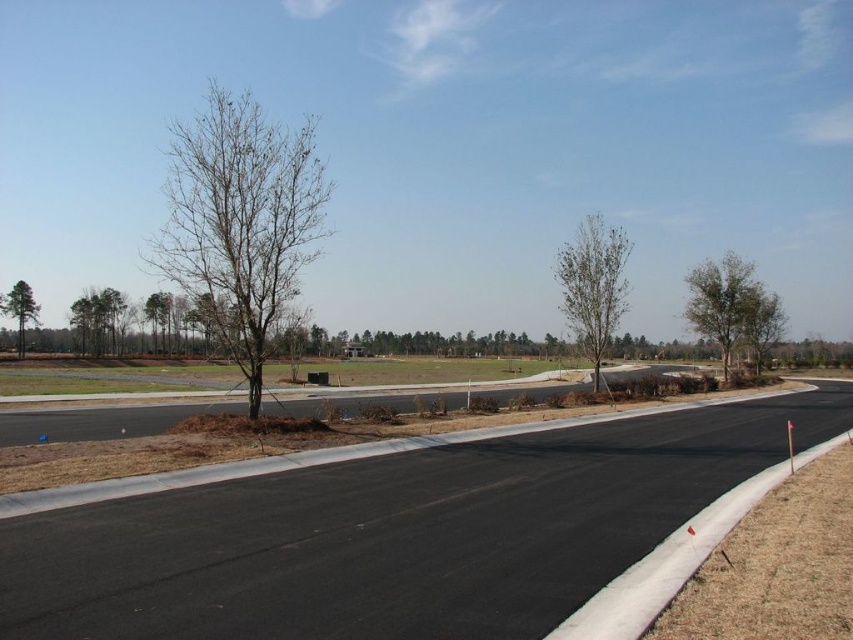
You are standing at the center of the newly paved road. Looking towards the direction of the road, where is the bare wood tree at left located relative to your position?

The bare wood tree at left is located at the left side of the road, positioned at coordinates approximately 0.502 on the x axis and 0.114 on the y axis relative to the road center.

You are a bird looking for a place to perch. You see the bare branches at left and the green leafy tree at right. Which tree is closer to you?

The bare branches at left is closer to you because it is in front of the green leafy tree at right.

You are a gardener planning to plant a new tree in this suburban area. You notice the bare branches at left and the green leafy tree at right. Which tree would you choose to plant a similar tree to, and why?

You should plant a similar tree to the green leafy tree at right because the bare branches at left has a larger size, which may indicate it is older or less suitable for new planting.